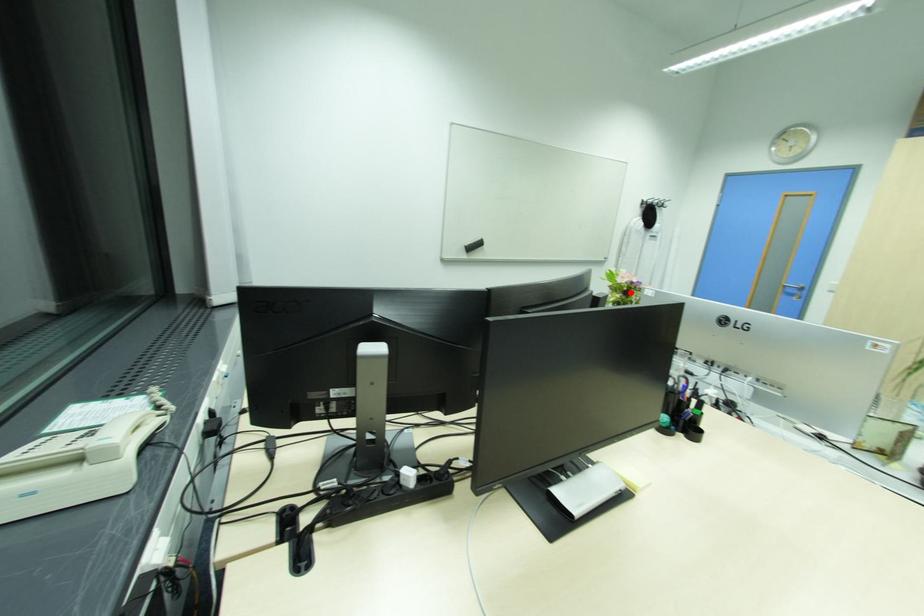
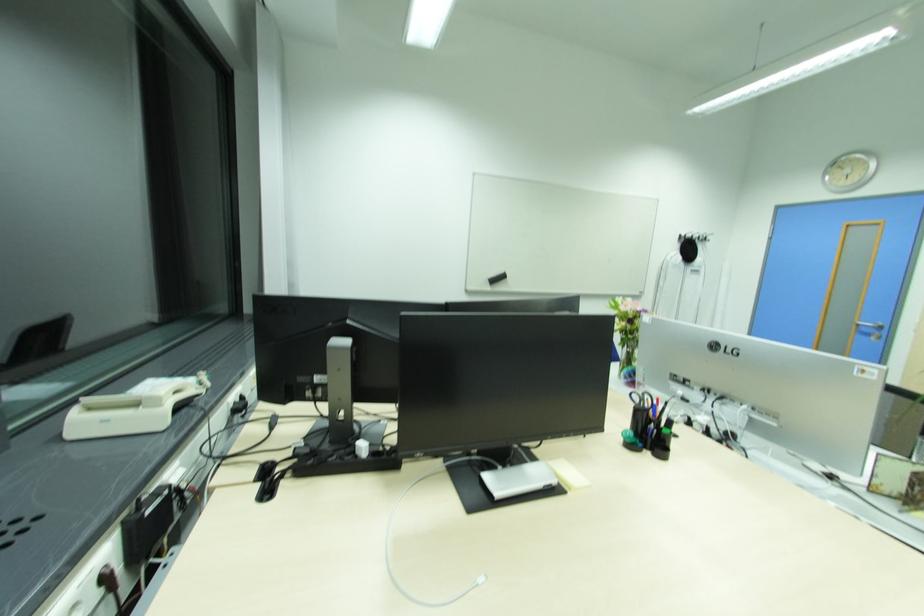
Find the pixel in the second image that matches the highlighted location in the first image.

(637, 321)